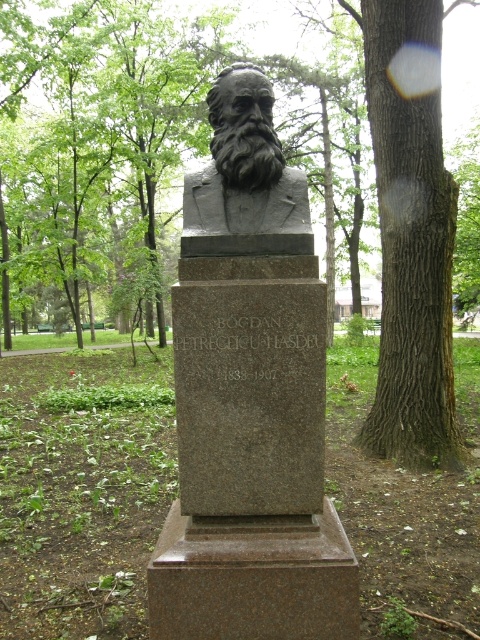
Question: Considering the real-world distances, which object is closest to the brown textured bark at center?

Choices:
 (A) granite bust at center
 (B) black stone bust at center

Answer: (A)

Question: Where is granite bust at center located in relation to brown textured bark at center in the image?

Choices:
 (A) right
 (B) left

Answer: (B)

Question: Does granite bust at center come behind black stone bust at center?

Choices:
 (A) no
 (B) yes

Answer: (A)

Question: Which object is positioned farthest from the brown textured tree trunk at center-right?

Choices:
 (A) black stone bust at center
 (B) granite bust at center

Answer: (A)

Question: Does brown textured tree trunk at center-right appear under brown textured bark at center?

Choices:
 (A) no
 (B) yes

Answer: (A)

Question: Estimate the real-world distances between objects in this image. Which object is closer to the black stone bust at center?

Choices:
 (A) brown textured bark at center
 (B) brown textured tree trunk at center-right

Answer: (A)